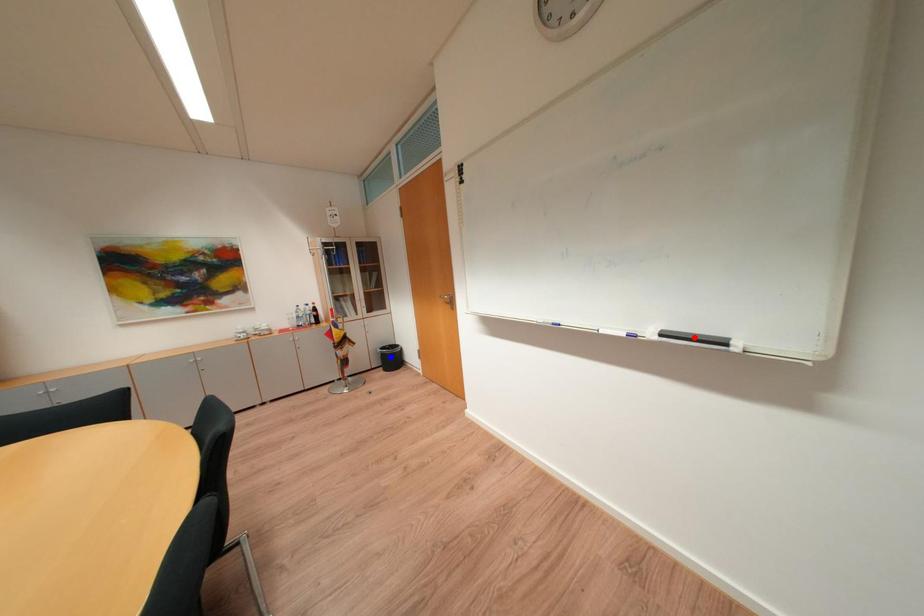
Question: Two points are marked on the image. Which point is closer to the camera?

Choices:
 (A) Blue point is closer.
 (B) Red point is closer.

Answer: (B)